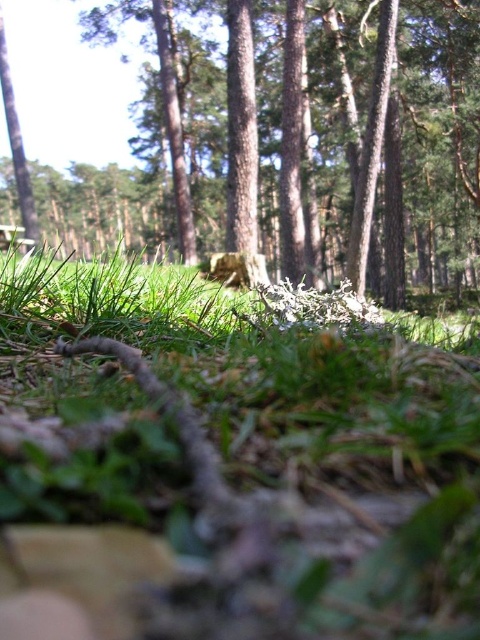
Which is in front, point (152, 316) or point (410, 97)?

Point (152, 316) is in front.

Can you confirm if green grass at center is shorter than rough bark tree at center?

Yes, green grass at center is shorter than rough bark tree at center.

Find the location of `green grass at center`. green grass at center is located at coordinates (233, 460).

Identify the location of green grass at center. (233, 460).